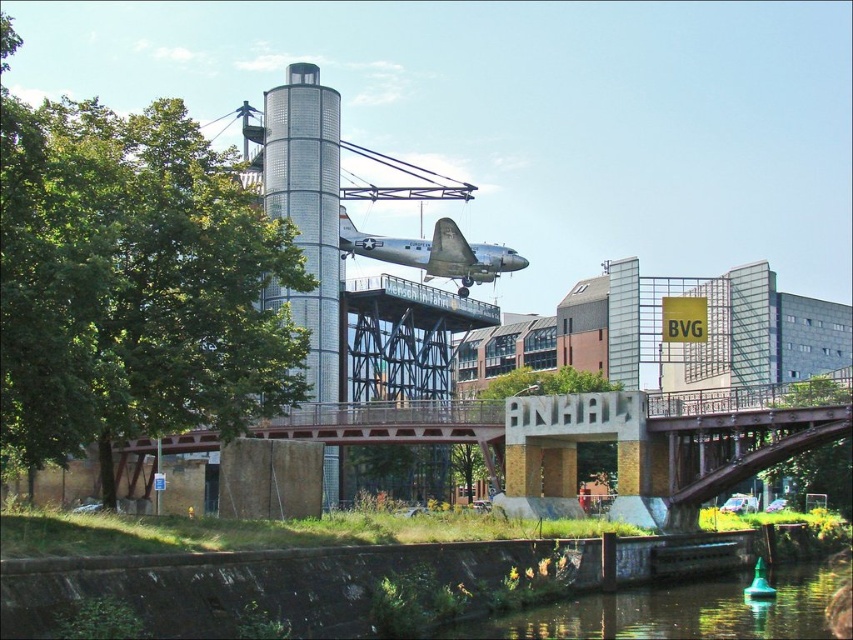
From the picture: You are standing at the entrance of the cylindrical building and want to cross to the other side of the bridge. Which object, the brown metal bridge at center or the silver metallic airplane at center, is nearer to you as you start crossing?

The brown metal bridge at center is closer to the viewer than the silver metallic airplane at center, so the brown metal bridge at center is nearer as you start crossing.

You are standing at the base of the cylindrical building and want to cross to the suspended airplane. The bridge is marked by the point at coordinates point (592, 435). Is the bridge between the cylindrical building and the suspended airplane?

The point (592, 435) marks the brown metal bridge at center, so yes, the bridge is between the cylindrical building and the suspended airplane.